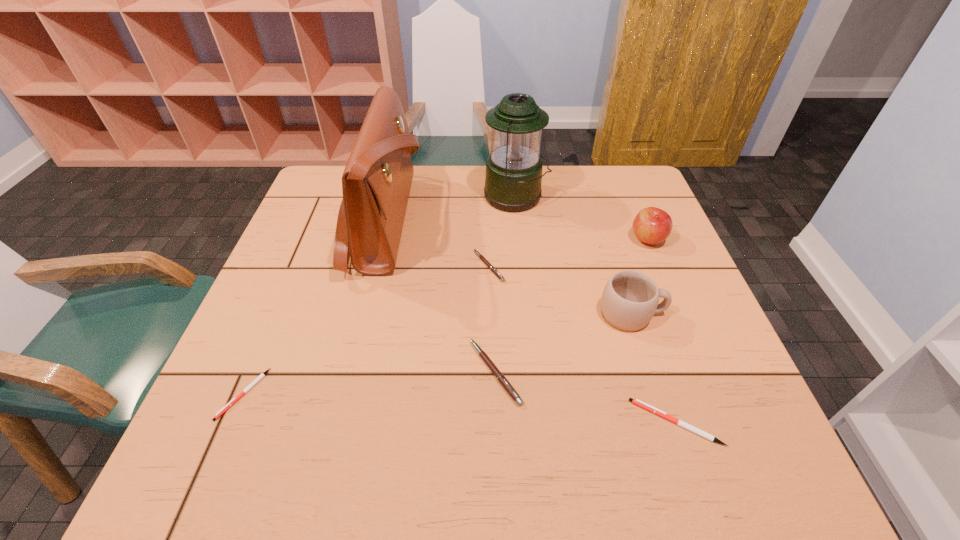
The height and width of the screenshot is (540, 960). I want to click on free space between the rightmost pen and the lantern, so click(595, 309).

At what (x,y) coordinates should I click in order to perform the action: click on vacant point located between the smaller pink pen and the shortest pen. Please return your answer as a coordinate pair (x, y). Image resolution: width=960 pixels, height=540 pixels. Looking at the image, I should click on (367, 330).

The image size is (960, 540). What are the coordinates of `object that is the second closest one to the bigger pink pen` in the screenshot? It's located at [630, 299].

At what (x,y) coordinates should I click in order to perform the action: click on object that is the second closest one to the apple. Please return your answer as a coordinate pair (x, y). Image resolution: width=960 pixels, height=540 pixels. Looking at the image, I should click on (513, 178).

I want to click on pen identified as the fourth closest to the lantern, so point(227,406).

Select which pen appears as the closest to the mug. Please provide its 2D coordinates. Your answer should be formatted as a tuple, i.e. [(x, y)], where the tuple contains the x and y coordinates of a point satisfying the conditions above.

[(637, 402)]

Find the location of a particular element. free space that satisfies the following two spatial constraints: 1. on the front flap of the second object from left to right; 2. on the clicker of the left white pen is located at coordinates (342, 394).

Identify the location of free space that satisfies the following two spatial constraints: 1. on the side of the mug with the handle; 2. on the clicker of the leftmost pen. (658, 394).

You are a GUI agent. You are given a task and a screenshot of the screen. Output one action in this format:
    pyautogui.click(x=<x>, y=<y>)
    Task: Click on the free space in the image that satisfies the following two spatial constraints: 1. on the front flap of the apple; 2. on the left side of the seventh object from right to left
    This screenshot has height=540, width=960.
    Given the screenshot: What is the action you would take?
    pyautogui.click(x=380, y=239)